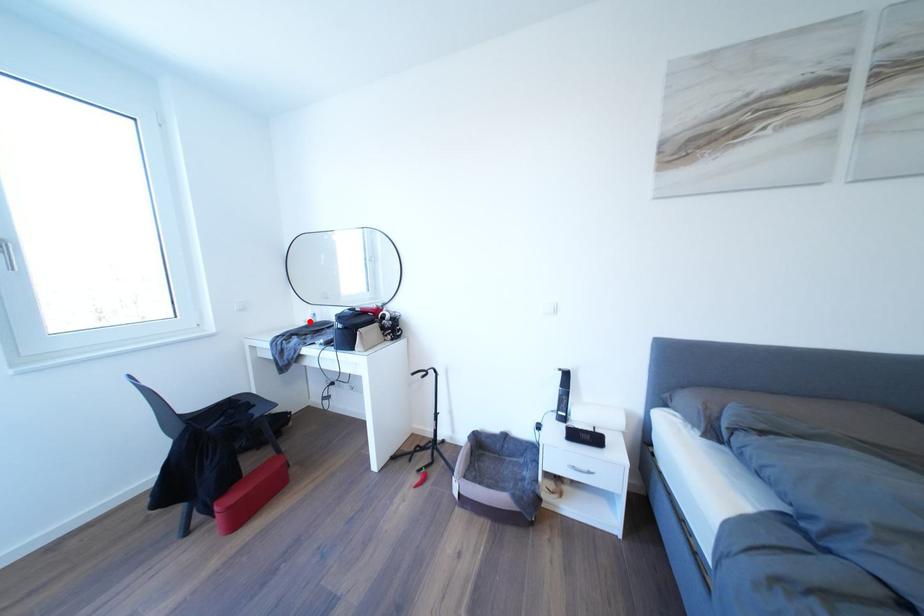
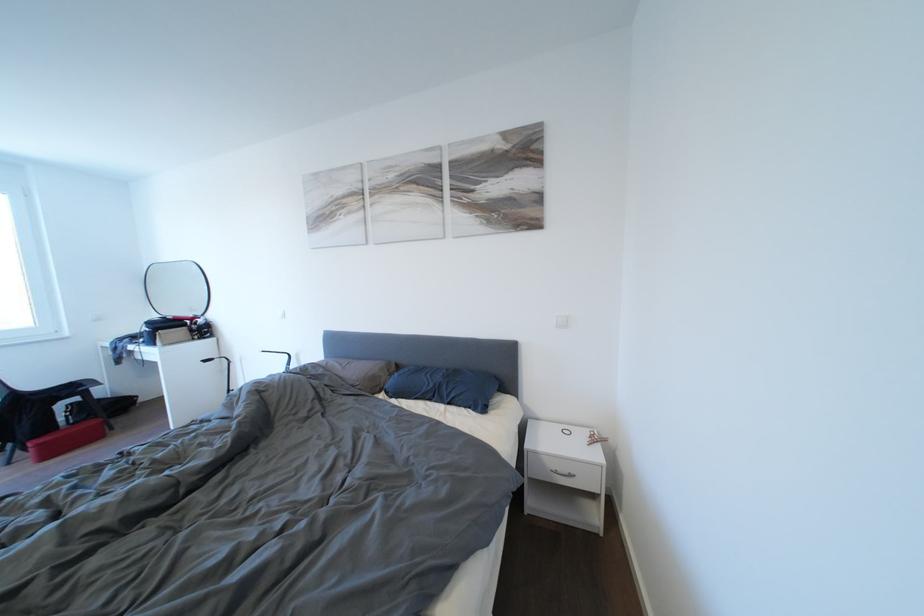
Question: I am providing you with two images of the same scene from different viewpoints. A red point is marked on the first image. Can you still see the location of the red point in image 2?

Choices:
 (A) Yes
 (B) No

Answer: (B)